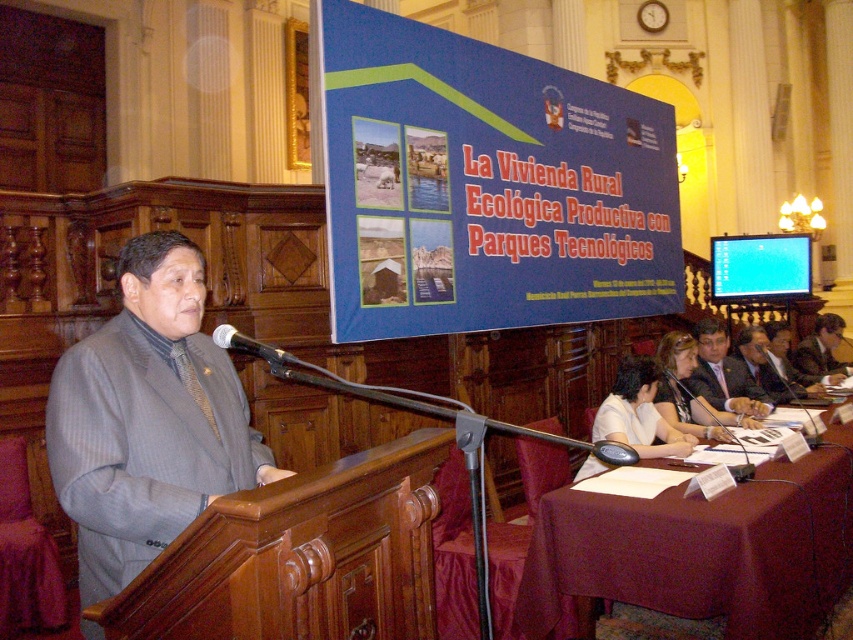
Question: Which point is closer to the camera?

Choices:
 (A) white paper at center
 (B) burgundy fabric table at lower right
 (C) dark gray wool business suit at lower right
 (D) matte gray suit at center

Answer: (B)

Question: Which of the following is the farthest from the observer?

Choices:
 (A) dark gray wool business suit at lower right
 (B) matte gray suit at center
 (C) matte black microphone at center
 (D) gray pinstripe suit at center

Answer: (A)

Question: Is white paper at center above dark gray wool business suit at lower right?

Choices:
 (A) yes
 (B) no

Answer: (B)

Question: Which object appears farthest from the camera in this image?

Choices:
 (A) burgundy fabric table at lower right
 (B) gray pinstripe suit at center
 (C) matte gray suit at center

Answer: (C)

Question: Can you confirm if burgundy fabric table at lower right is positioned above white paper at center?

Choices:
 (A) yes
 (B) no

Answer: (B)

Question: Does gray pinstripe suit at center appear over matte gray suit at center?

Choices:
 (A) yes
 (B) no

Answer: (A)